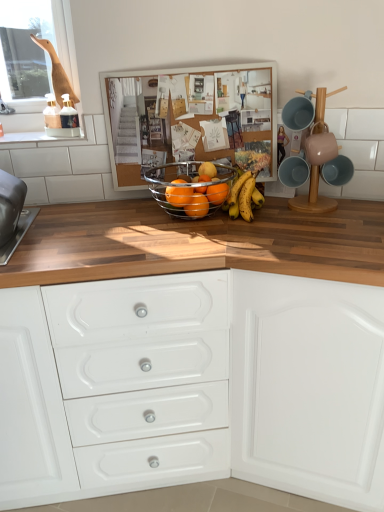
At what (x,y) coordinates should I click in order to perform the action: click on free space to the left of metallic orange fruit at center, the 3th orange from the right. Please return your answer as a coordinate pair (x, y). Looking at the image, I should click on (140, 221).